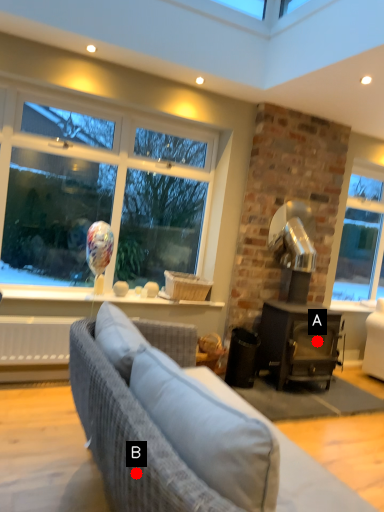
Question: Two points are circled on the image, labeled by A and B beside each circle. Among these points, which one is nearest to the camera?

Choices:
 (A) A is closer
 (B) B is closer

Answer: (B)